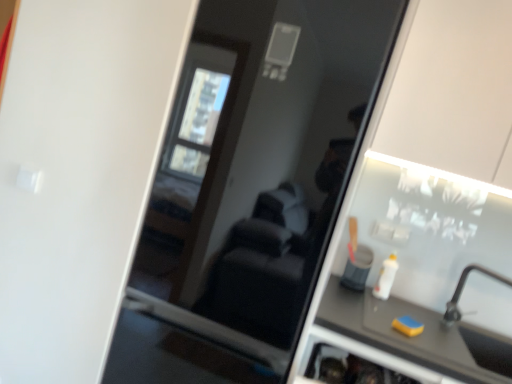
This screenshot has width=512, height=384. Identify the location of vacant area that is in front of white plastic bottle at right. (x=381, y=301).